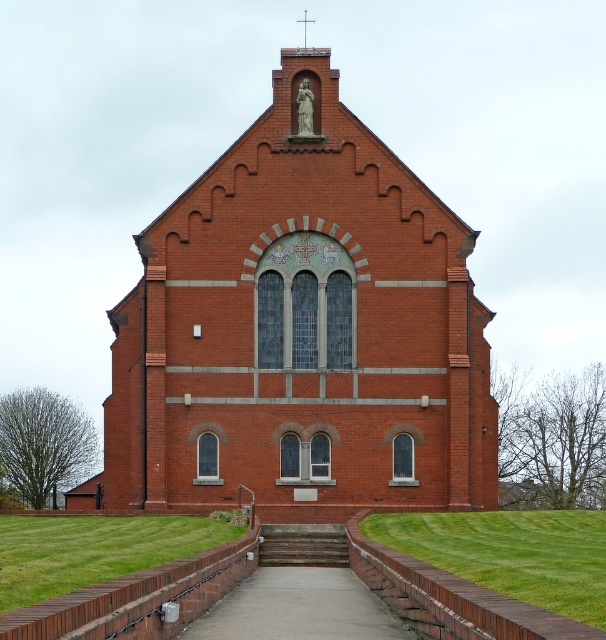
You are standing in front of the church and want to place a small flowerpot on the concrete at center. Can you place it directly below the red brick church at center?

Yes, because the red brick church at center is above the concrete at center, so placing the flowerpot on the concrete at center would be directly below the church.

You are standing at a certain distance from the red brick church at center. If you want to take a photo that captures the entire facade of the church without any cropping, what is the minimum distance you should maintain from the church?

To capture the entire facade of the red brick church at center in a single photo without cropping, you should maintain a minimum distance of approximately 290.32 feet from the church.

You are standing at the bottom of the wooden stairs at center leading to the red brick church at center. Which direction should you walk to reach the church entrance?

The red brick church at center is positioned over the wooden stairs at center, so you should walk upwards along the wooden stairs at center to reach the church entrance.